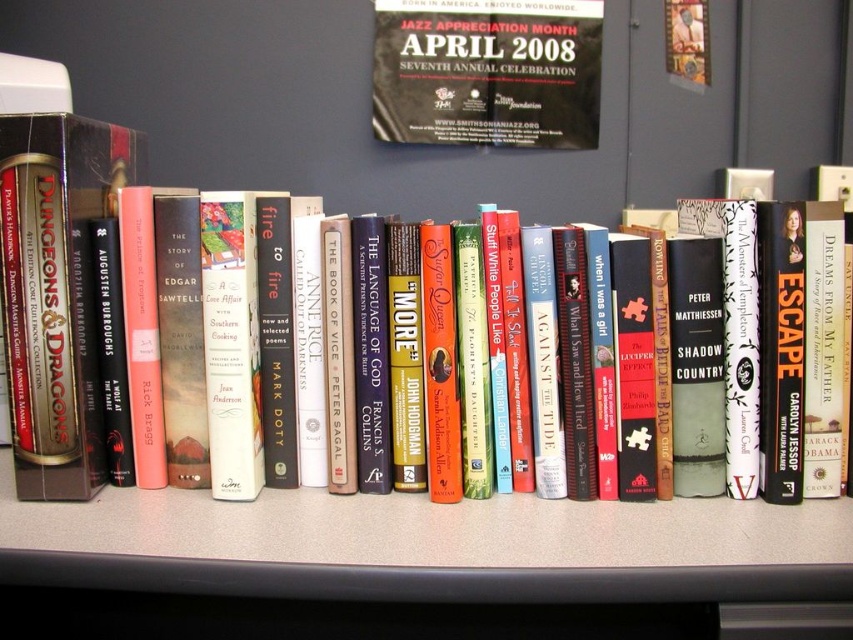
Can you confirm if gray laminate table at center is taller than hardcover book at center?

In fact, gray laminate table at center may be shorter than hardcover book at center.

From the picture: Is gray laminate table at center bigger than hardcover book at center?

Correct, gray laminate table at center is larger in size than hardcover book at center.

Who is more distant from viewer, (738, 579) or (251, 289)?

The point (251, 289) is more distant.

Find the location of a particular element. The image size is (853, 640). gray laminate table at center is located at coordinates (428, 547).